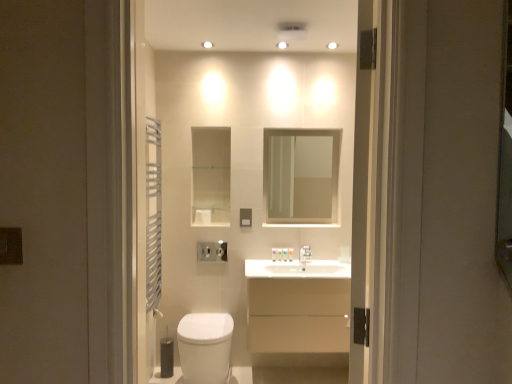
The width and height of the screenshot is (512, 384). What do you see at coordinates (345, 254) in the screenshot? I see `white matte toilet paper at right, the first toilet paper positioned from the right` at bounding box center [345, 254].

What do you see at coordinates (298, 307) in the screenshot? I see `beige matte cabinet at center` at bounding box center [298, 307].

The width and height of the screenshot is (512, 384). I want to click on clear glass mirror at upper center, so click(x=301, y=176).

At what (x,y) coordinates should I click in order to perform the action: click on white glossy toilet at center. Please return your answer as a coordinate pair (x, y). This screenshot has height=384, width=512. Looking at the image, I should click on (239, 144).

Identify the location of white matte toilet paper at center, which appears as the 1th toilet paper when viewed from the left. The image size is (512, 384). (203, 217).

Is white glossy sink at center located outside white glossy toilet at lower center?

Yes, white glossy sink at center is located beyond the bounds of white glossy toilet at lower center.

Considering the sizes of objects white glossy sink at center and white glossy toilet at lower center in the image provided, who is shorter, white glossy sink at center or white glossy toilet at lower center?

white glossy sink at center.

From the image's perspective, would you say white glossy sink at center is shown under white glossy toilet at lower center?

No.

Are white glossy sink at center and white glossy toilet at lower center beside each other?

No.

In the scene shown: Considering the positions of objects matte black switch at left, arranged as the 2th electric outlet when viewed from the right, and white matte toilet paper at right, which is the 1th toilet paper from bottom to top, in the image provided, who is behind, matte black switch at left, arranged as the 2th electric outlet when viewed from the right, or white matte toilet paper at right, which is the 1th toilet paper from bottom to top,?

white matte toilet paper at right, which is the 1th toilet paper from bottom to top, is further away from the camera.

What's the angular difference between matte black switch at left, the second electric outlet in the back-to-front sequence, and white matte toilet paper at right, which is the 1th toilet paper from bottom to top,'s facing directions?

They differ by 2.24 degrees in their facing directions.

Is matte black switch at left, which is the first electric outlet in front-to-back order, wider or thinner than white matte toilet paper at right, the second toilet paper viewed from the left?

Considering their sizes, matte black switch at left, which is the first electric outlet in front-to-back order, looks slimmer than white matte toilet paper at right, the second toilet paper viewed from the left.

From a real-world perspective, starting from the matte black switch at left, arranged as the 2th electric outlet when viewed from the right, which toilet paper is the 2nd one below it? Please provide its 2D coordinates.

[(345, 254)]

Is white glossy sink at center beside white glossy toilet at center?

No, white glossy sink at center is not in contact with white glossy toilet at center.

From a real-world perspective, is white glossy sink at center beneath white glossy toilet at center?

Yes, from a real-world perspective, white glossy sink at center is beneath white glossy toilet at center.

Consider the image. Is white glossy sink at center facing away from white glossy toilet at center?

white glossy sink at center is not turned away from white glossy toilet at center.

Is white glossy sink at center thinner than white glossy toilet at center?

Incorrect, the width of white glossy sink at center is not less than that of white glossy toilet at center.

Considering the sizes of objects white matte toilet paper at center, which is counted as the 2th toilet paper, starting from the bottom, and white glossy sink at center in the image provided, who is shorter, white matte toilet paper at center, which is counted as the 2th toilet paper, starting from the bottom, or white glossy sink at center?

Standing shorter between the two is white matte toilet paper at center, which is counted as the 2th toilet paper, starting from the bottom.

Considering the sizes of objects white matte toilet paper at center, the first toilet paper positioned from the top, and white glossy sink at center in the image provided, who is thinner, white matte toilet paper at center, the first toilet paper positioned from the top, or white glossy sink at center?

white matte toilet paper at center, the first toilet paper positioned from the top, is thinner.

Is white matte toilet paper at center, which appears as the 1th toilet paper when viewed from the left, inside the boundaries of white glossy sink at center, or outside?

white matte toilet paper at center, which appears as the 1th toilet paper when viewed from the left, is outside white glossy sink at center.

Looking at this image, which point is more distant from viewer, (198, 211) or (310, 304)?

Point (198, 211)

Is white glossy toilet at center aimed at white matte toilet paper at right, which is the 1th toilet paper from bottom to top?

Yes.

Considering the positions of objects white glossy toilet at center and white matte toilet paper at right, the first toilet paper positioned from the right, in the image provided, who is in front, white glossy toilet at center or white matte toilet paper at right, the first toilet paper positioned from the right,?

white glossy toilet at center is more forward.

Does point (159, 119) lie behind point (350, 257)?

Yes, it is.

Looking at this image, from a real-world perspective, is white glossy toilet at center physically above white matte toilet paper at right, the first toilet paper positioned from the right?

Correct, in the physical world, white glossy toilet at center is higher than white matte toilet paper at right, the first toilet paper positioned from the right.

Considering the points (330, 184) and (205, 213), which point is behind, point (330, 184) or point (205, 213)?

Positioned behind is point (330, 184).

Could you tell me if clear glass mirror at upper center is turned towards white matte toilet paper at center, which is counted as the 2th toilet paper, starting from the bottom?

No, clear glass mirror at upper center does not turn towards white matte toilet paper at center, which is counted as the 2th toilet paper, starting from the bottom.

Can you see clear glass mirror at upper center touching white matte toilet paper at center, the first toilet paper positioned from the top?

No.

Could you tell me if white glossy toilet at center is turned towards matte black switch at left, arranged as the 2th electric outlet when viewed from the right?

No, white glossy toilet at center is not turned towards matte black switch at left, arranged as the 2th electric outlet when viewed from the right.

Looking at this image, considering the sizes of white glossy toilet at center and matte black switch at left, arranged as the 2th electric outlet when viewed from the right, in the image, is white glossy toilet at center wider or thinner than matte black switch at left, arranged as the 2th electric outlet when viewed from the right,?

Considering their sizes, white glossy toilet at center looks broader than matte black switch at left, arranged as the 2th electric outlet when viewed from the right.

Which of these two, white glossy toilet at center or matte black switch at left, which is the first electric outlet in front-to-back order, is bigger?

With larger size is white glossy toilet at center.

At what (x,y) coordinates should I click in order to perform the action: click on counter top located behind the white glossy toilet at lower center. Please return your answer as a coordinate pair (x, y). The height and width of the screenshot is (384, 512). Looking at the image, I should click on (298, 288).

Which toilet paper is the 2nd one when counting from the right side of the matte black switch at left, the second electric outlet in the back-to-front sequence? Please provide its 2D coordinates.

[(345, 254)]

When comparing their distances from matte gray electric outlet at center, the second electric outlet positioned from the front, does clear glass mirror at upper center or matte black switch at left, positioned as the 1th electric outlet in left-to-right order, seem closer?

clear glass mirror at upper center is positioned closer to the anchor matte gray electric outlet at center, the second electric outlet positioned from the front.

Based on their spatial positions, is white glossy toilet at center or beige matte cabinet at center further from white matte toilet paper at center, which appears as the 1th toilet paper when viewed from the left?

beige matte cabinet at center.

Looking at this image, considering their positions, is beige matte cabinet at center positioned further to white matte toilet paper at right, which is counted as the 2th toilet paper, starting from the top, than clear glass mirror at upper center?

clear glass mirror at upper center.

From the image, which object appears to be farther from clear glass mirror at upper center, white matte toilet paper at right, the first toilet paper positioned from the right, or white glossy sink at center?

white glossy sink at center lies further to clear glass mirror at upper center than the other object.

Based on the photo, based on their spatial positions, is beige matte cabinet at center or white matte toilet paper at center, which is counted as the 2th toilet paper, starting from the right, further from white matte toilet paper at right, which is counted as the 2th toilet paper, starting from the top?

Based on the image, white matte toilet paper at center, which is counted as the 2th toilet paper, starting from the right, appears to be further to white matte toilet paper at right, which is counted as the 2th toilet paper, starting from the top.

Which object lies nearer to the anchor point white matte toilet paper at center, the first toilet paper positioned from the top, white glossy toilet at center or clear glass mirror at upper center?

Based on the image, white glossy toilet at center appears to be nearer to white matte toilet paper at center, the first toilet paper positioned from the top.

Consider the image. From the image, which object appears to be farther from white glossy toilet at lower center, white matte toilet paper at center, the first toilet paper positioned from the top, or white matte toilet paper at right, which is the 1th toilet paper from bottom to top?

white matte toilet paper at right, which is the 1th toilet paper from bottom to top, lies further to white glossy toilet at lower center than the other object.

Looking at this image, which object lies further to the anchor point white matte toilet paper at center, which is counted as the 2th toilet paper, starting from the right, matte black switch at left, positioned as the 1th electric outlet in left-to-right order, or clear glass mirror at upper center?

matte black switch at left, positioned as the 1th electric outlet in left-to-right order, is further to white matte toilet paper at center, which is counted as the 2th toilet paper, starting from the right.

Where is `counter top positioned between white glossy toilet at center and clear glass mirror at upper center from near to far`? The height and width of the screenshot is (384, 512). counter top positioned between white glossy toilet at center and clear glass mirror at upper center from near to far is located at coordinates (298, 288).

The width and height of the screenshot is (512, 384). In order to click on toilet between white glossy toilet at center and beige matte cabinet at center in the front-back direction in this screenshot , I will do (205, 347).

Where is `counter top between matte gray electric outlet at center, the 1th electric outlet viewed from the back, and beige matte cabinet at center vertically`? This screenshot has height=384, width=512. counter top between matte gray electric outlet at center, the 1th electric outlet viewed from the back, and beige matte cabinet at center vertically is located at coordinates (298, 288).

Locate an element on the screen. This screenshot has width=512, height=384. counter top situated between white glossy toilet at lower center and white matte toilet paper at right, which is the 1th toilet paper from bottom to top, from left to right is located at coordinates (298, 288).